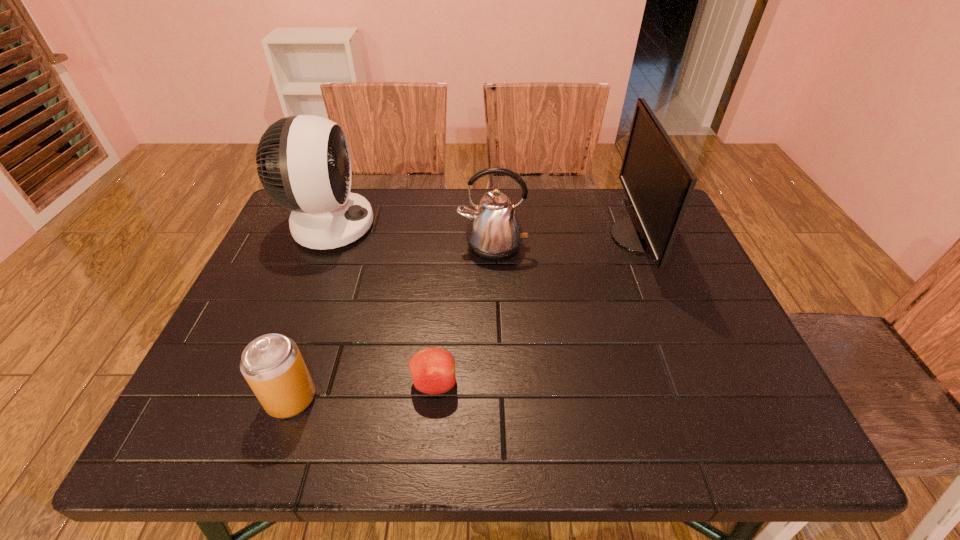
Identify the location of fan. (304, 164).

Identify the location of the rightmost object. The image size is (960, 540). (658, 183).

At what (x,y) coordinates should I click in order to perform the action: click on kettle. Please return your answer as a coordinate pair (x, y). Looking at the image, I should click on (494, 233).

Where is `the fourth tallest object`? This screenshot has height=540, width=960. the fourth tallest object is located at coordinates (272, 365).

The height and width of the screenshot is (540, 960). Identify the location of apple. (432, 370).

Image resolution: width=960 pixels, height=540 pixels. What are the coordinates of `vacant space located on the grille of the fan` in the screenshot? It's located at (512, 226).

Where is `vacant space located 0.150m on the screen side of the monitor`? vacant space located 0.150m on the screen side of the monitor is located at coordinates (557, 237).

Locate an element on the screen. The image size is (960, 540). vacant space located on the screen side of the monitor is located at coordinates (546, 237).

The height and width of the screenshot is (540, 960). In order to click on free space located 0.120m on the screen side of the monitor in this screenshot , I will do `click(568, 237)`.

I want to click on free region located 0.210m from the spout of the third shortest object, so click(495, 328).